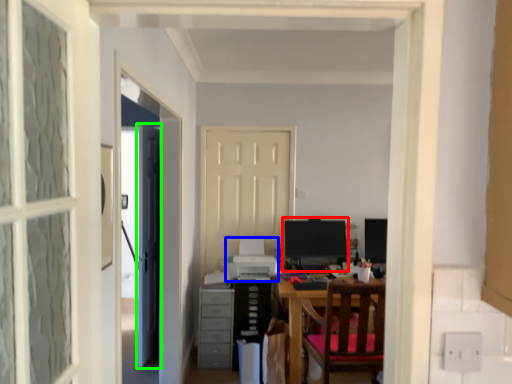
Question: Which is farther away from computer monitor (highlighted by a red box)? printer (highlighted by a blue box) or door (highlighted by a green box)?

Choices:
 (A) printer
 (B) door

Answer: (B)